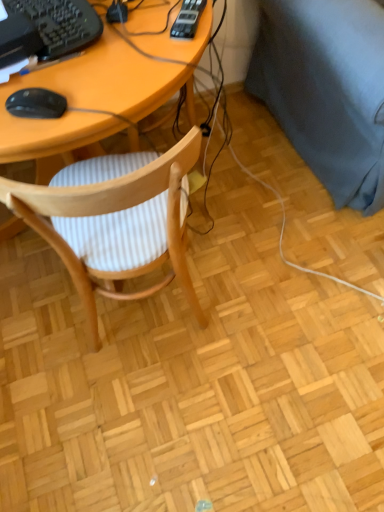
Question: Considering the relative sizes of black matte mouse at left and dark blue fabric couch at right in the image provided, is black matte mouse at left shorter than dark blue fabric couch at right?

Choices:
 (A) yes
 (B) no

Answer: (A)

Question: From a real-world perspective, is black matte mouse at left below dark blue fabric couch at right?

Choices:
 (A) yes
 (B) no

Answer: (B)

Question: Considering the relative sizes of black matte mouse at left and dark blue fabric couch at right in the image provided, is black matte mouse at left smaller than dark blue fabric couch at right?

Choices:
 (A) no
 (B) yes

Answer: (B)

Question: Would you say dark blue fabric couch at right is part of black matte mouse at left's contents?

Choices:
 (A) yes
 (B) no

Answer: (B)

Question: Is black matte mouse at left positioned far away from dark blue fabric couch at right?

Choices:
 (A) no
 (B) yes

Answer: (A)

Question: Is black plastic keyboard at upper left wider or thinner than black matte mouse at left?

Choices:
 (A) thin
 (B) wide

Answer: (B)

Question: Is black plastic keyboard at upper left in front of or behind black matte mouse at left in the image?

Choices:
 (A) front
 (B) behind

Answer: (B)

Question: In the image, is black plastic keyboard at upper left on the left side or the right side of black matte mouse at left?

Choices:
 (A) left
 (B) right

Answer: (A)

Question: Is black plastic keyboard at upper left taller or shorter than black matte mouse at left?

Choices:
 (A) tall
 (B) short

Answer: (B)

Question: Is point (84, 274) closer or farther from the camera than point (49, 18)?

Choices:
 (A) farther
 (B) closer

Answer: (A)

Question: In the image, is wooden chair with striped cushion at center positioned in front of or behind black plastic keyboard at upper left?

Choices:
 (A) behind
 (B) front

Answer: (B)

Question: Looking at the image, does wooden chair with striped cushion at center seem bigger or smaller compared to black plastic keyboard at upper left?

Choices:
 (A) small
 (B) big

Answer: (B)

Question: Is wooden chair with striped cushion at center situated inside black plastic keyboard at upper left or outside?

Choices:
 (A) outside
 (B) inside

Answer: (A)

Question: Considering the positions of point (26, 3) and point (56, 249), is point (26, 3) closer or farther from the camera than point (56, 249)?

Choices:
 (A) closer
 (B) farther

Answer: (A)

Question: In terms of width, does black plastic keyboard at upper left look wider or thinner when compared to wooden chair with striped cushion at center?

Choices:
 (A) wide
 (B) thin

Answer: (B)